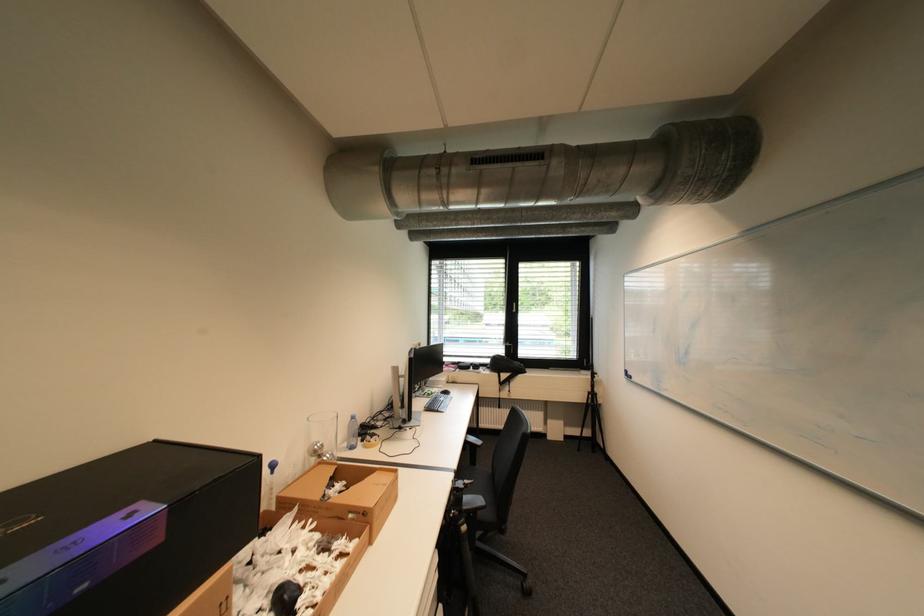
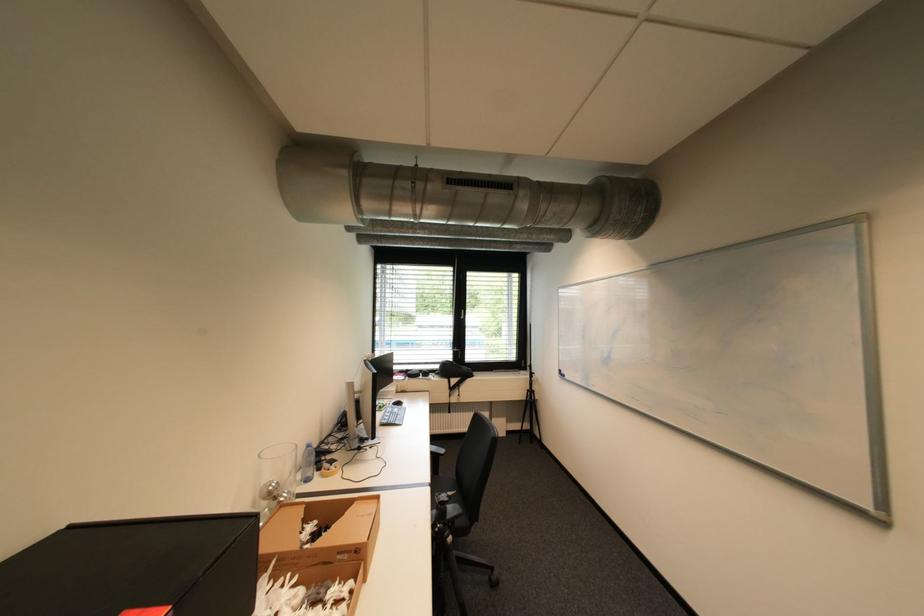
Find the pixel in the second image that matches (359,419) in the first image.

(313, 448)